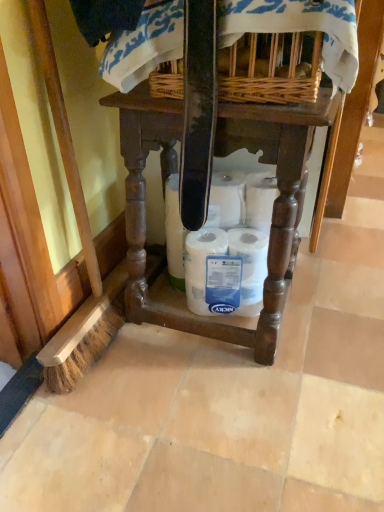
What is the approximate height of woven wicker basket at upper center?

It is 6.82 inches.

What is the approximate height of white matte toilet paper at center?

white matte toilet paper at center is 22.98 centimeters in height.

The height and width of the screenshot is (512, 384). What are the coordinates of `wooden table at center` in the screenshot? It's located at (219, 155).

Locate an element on the screen. woven wicker basket at upper center is located at coordinates (269, 72).

Is wooden table at center placed right next to white matte toilet paper at center?

No, wooden table at center is not in contact with white matte toilet paper at center.

In the scene shown: Can you confirm if wooden table at center is thinner than white matte toilet paper at center?

In fact, wooden table at center might be wider than white matte toilet paper at center.

Based on the photo, between wooden table at center and white matte toilet paper at center, which one has smaller size?

Smaller between the two is white matte toilet paper at center.

Considering the sizes of objects wooden table at center and white matte toilet paper at center in the image provided, who is shorter, wooden table at center or white matte toilet paper at center?

white matte toilet paper at center.

Who is taller, woven wicker basket at upper center or white matte toilet paper at center?

white matte toilet paper at center.

Considering the positions of objects woven wicker basket at upper center and white matte toilet paper at center in the image provided, who is in front, woven wicker basket at upper center or white matte toilet paper at center?

woven wicker basket at upper center is more forward.

Identify the location of toilet paper below the woven wicker basket at upper center (from a real-world perspective). The width and height of the screenshot is (384, 512). (222, 247).

What's the angular difference between woven wicker basket at upper center and white matte toilet paper at center's facing directions?

They differ by 69.9 degrees in their facing directions.

How many degrees apart are the facing directions of woven wicker basket at upper center and wooden table at center?

2.8 degrees.

Is wooden table at center at the back of woven wicker basket at upper center?

That's not correct — woven wicker basket at upper center is not looking away from wooden table at center.

Considering the sizes of objects woven wicker basket at upper center and wooden table at center in the image provided, who is taller, woven wicker basket at upper center or wooden table at center?

With more height is wooden table at center.

Which of these two, woven wicker basket at upper center or wooden table at center, is bigger?

wooden table at center.

From the image's perspective, between white matte toilet paper at center and wooden table at center, who is located below?

white matte toilet paper at center.

Which object is further away from the camera, white matte toilet paper at center or wooden table at center?

white matte toilet paper at center.

Considering the relative sizes of white matte toilet paper at center and wooden table at center in the image provided, is white matte toilet paper at center bigger than wooden table at center?

Actually, white matte toilet paper at center might be smaller than wooden table at center.

Is white matte toilet paper at center positioned with its back to wooden table at center?

That's right, white matte toilet paper at center is facing away from wooden table at center.

From the image's perspective, would you say wooden table at center is positioned over woven wicker basket at upper center?

Incorrect, from the image's perspective, wooden table at center is lower than woven wicker basket at upper center.

Can you tell me how much wooden table at center and woven wicker basket at upper center differ in facing direction?

The angular difference between wooden table at center and woven wicker basket at upper center is 2.8 degrees.

In terms of height, does wooden table at center look taller or shorter compared to woven wicker basket at upper center?

In the image, wooden table at center appears to be taller than woven wicker basket at upper center.

In the scene shown: From a real-world perspective, which is physically below, wooden table at center or woven wicker basket at upper center?

In real-world perspective, wooden table at center is lower.

From the picture: Considering the relative positions of white matte toilet paper at center and woven wicker basket at upper center in the image provided, is white matte toilet paper at center to the right of woven wicker basket at upper center from the viewer's perspective?

Correct, you'll find white matte toilet paper at center to the right of woven wicker basket at upper center.

Considering the sizes of objects white matte toilet paper at center and woven wicker basket at upper center in the image provided, who is smaller, white matte toilet paper at center or woven wicker basket at upper center?

white matte toilet paper at center is smaller.

Which of these two, white matte toilet paper at center or woven wicker basket at upper center, stands shorter?

Standing shorter between the two is woven wicker basket at upper center.

Where is `toilet paper behind the wooden table at center`? toilet paper behind the wooden table at center is located at coordinates (222, 247).

You are a GUI agent. You are given a task and a screenshot of the screen. Output one action in this format:
    pyautogui.click(x=<x>, y=<y>)
    Task: Click on the toilet paper on the right of woven wicker basket at upper center
    This screenshot has width=384, height=512.
    Given the screenshot: What is the action you would take?
    pyautogui.click(x=222, y=247)

Based on their spatial positions, is white matte toilet paper at center or wooden table at center further from woven wicker basket at upper center?

white matte toilet paper at center is positioned further to the anchor woven wicker basket at upper center.

Estimate the real-world distances between objects in this image. Which object is further from wooden table at center, white matte toilet paper at center or woven wicker basket at upper center?

The object further to wooden table at center is woven wicker basket at upper center.

Estimate the real-world distances between objects in this image. Which object is closer to wooden table at center, woven wicker basket at upper center or white matte toilet paper at center?

Among the two, white matte toilet paper at center is located nearer to wooden table at center.

From the picture: From the image, which object appears to be nearer to woven wicker basket at upper center, wooden table at center or white matte toilet paper at center?

wooden table at center.

Looking at the image, which one is located further to white matte toilet paper at center, wooden table at center or woven wicker basket at upper center?

Among the two, woven wicker basket at upper center is located further to white matte toilet paper at center.

Estimate the real-world distances between objects in this image. Which object is further from white matte toilet paper at center, woven wicker basket at upper center or wooden table at center?

Among the two, woven wicker basket at upper center is located further to white matte toilet paper at center.

At what (x,y) coordinates should I click in order to perform the action: click on furniture that lies between woven wicker basket at upper center and white matte toilet paper at center from top to bottom. Please return your answer as a coordinate pair (x, y). The height and width of the screenshot is (512, 384). Looking at the image, I should click on (219, 155).